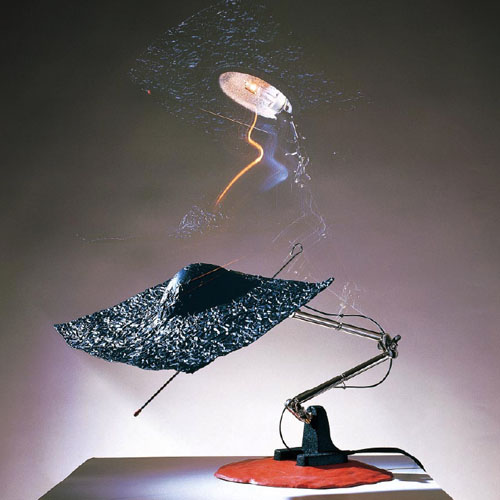
The width and height of the screenshot is (500, 500). Identify the location of black metal bracket at base of lamp on top of round brown plastic. (318, 439).